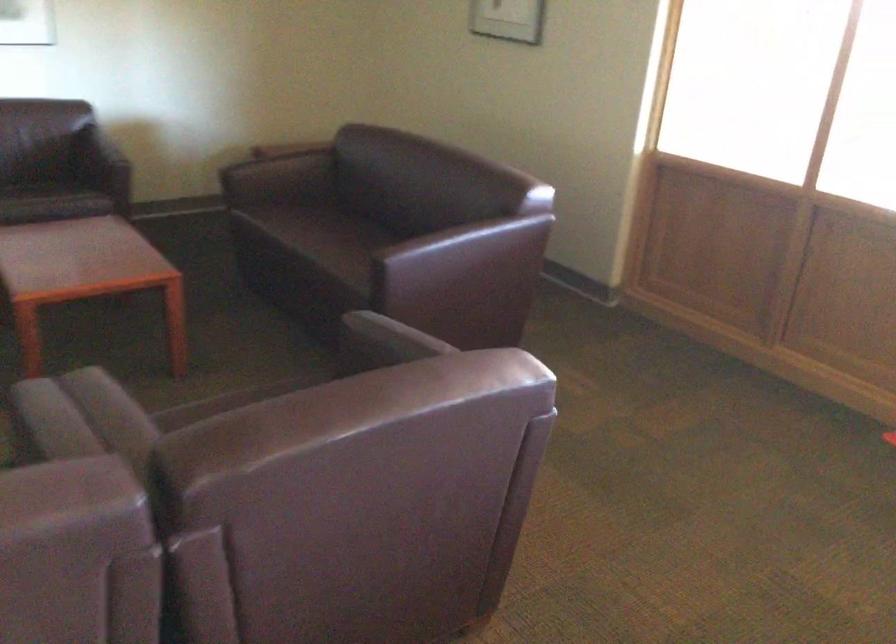
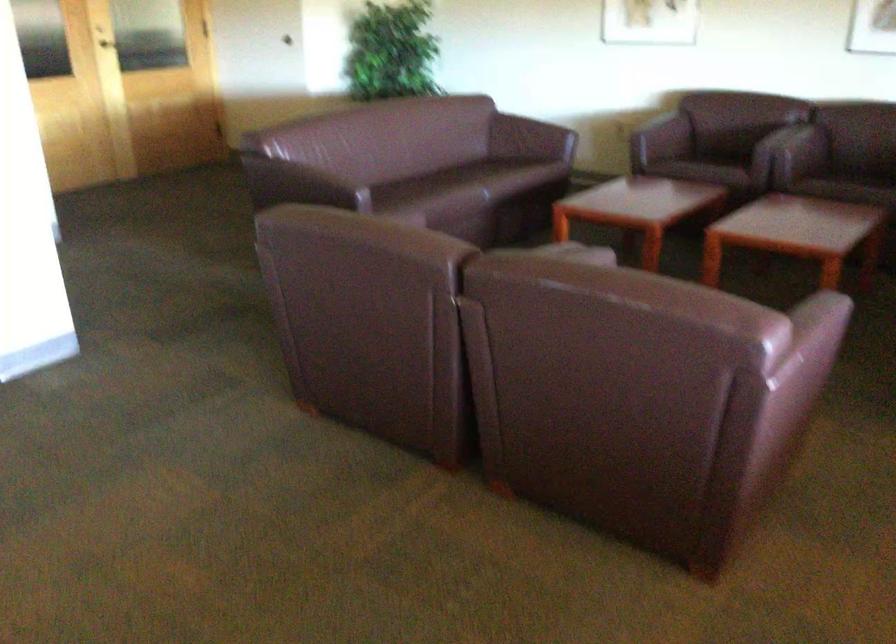
In the second image, find the point that corresponds to the point at 69,204 in the first image.

(853, 185)